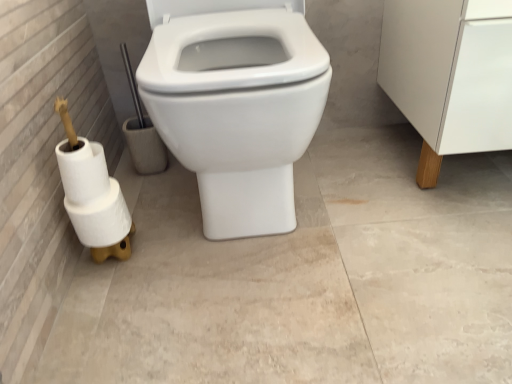
This screenshot has height=384, width=512. What do you see at coordinates (237, 110) in the screenshot?
I see `white glossy toilet at center` at bounding box center [237, 110].

In order to face white matte toilet paper at lower left, the third toilet paper from the top, should I rotate leftwards or rightwards?

Turn left approximately 20.398 degrees to face it.

Locate an element on the screen. This screenshot has width=512, height=384. white matte toilet paper at left, which ranks as the second toilet paper in bottom-to-top order is located at coordinates (92, 194).

Locate an element on the screen. The width and height of the screenshot is (512, 384). white matte toilet paper at lower left, which is counted as the third toilet paper, starting from the bottom is located at coordinates (82, 170).

You are a GUI agent. You are given a task and a screenshot of the screen. Output one action in this format:
    pyautogui.click(x=<x>, y=<y>)
    Task: Click on the white glossy toilet at center
    The image size is (512, 384).
    Given the screenshot: What is the action you would take?
    pyautogui.click(x=237, y=110)

Is white matte toilet paper at lower left, placed as the first toilet paper when sorted from top to bottom, not inside white wood cabinet leg at right?

Result: Yes, white matte toilet paper at lower left, placed as the first toilet paper when sorted from top to bottom, is located beyond the bounds of white wood cabinet leg at right.

Is white matte toilet paper at lower left, placed as the first toilet paper when sorted from top to bottom, beside white wood cabinet leg at right?

No, white matte toilet paper at lower left, placed as the first toilet paper when sorted from top to bottom, is not making contact with white wood cabinet leg at right.

From a real-world perspective, is white matte toilet paper at lower left, placed as the first toilet paper when sorted from top to bottom, positioned under white wood cabinet leg at right based on gravity?

Yes.

From the image's perspective, count 2nd toilet papers upward from the white matte toilet paper at lower left, the third toilet paper from the top, and point to it. Please provide its 2D coordinates.

[(82, 170)]

Considering the positions of objects white matte toilet paper at lower left, which is counted as the third toilet paper, starting from the bottom, and white matte toilet paper at lower left, the third toilet paper from the top, in the image provided, who is more to the left, white matte toilet paper at lower left, which is counted as the third toilet paper, starting from the bottom, or white matte toilet paper at lower left, the third toilet paper from the top,?

white matte toilet paper at lower left, which is counted as the third toilet paper, starting from the bottom, is more to the left.

Can you confirm if white matte toilet paper at lower left, which is counted as the third toilet paper, starting from the bottom, is smaller than white matte toilet paper at lower left, the third toilet paper from the top?

Indeed, white matte toilet paper at lower left, which is counted as the third toilet paper, starting from the bottom, has a smaller size compared to white matte toilet paper at lower left, the third toilet paper from the top.

Does point (127, 220) come farther from viewer compared to point (111, 240)?

That is True.

Is the depth of white matte toilet paper at lower left, the third toilet paper from the top, less than that of white matte toilet paper at left, which is the 2th toilet paper from top to bottom?

No, the depth of white matte toilet paper at lower left, the third toilet paper from the top, is greater than that of white matte toilet paper at left, which is the 2th toilet paper from top to bottom.

From a real-world perspective, between white matte toilet paper at lower left, the third toilet paper from the top, and white matte toilet paper at left, which is the 2th toilet paper from top to bottom, who is vertically higher?

In real-world perspective, white matte toilet paper at left, which is the 2th toilet paper from top to bottom, is above.

Which object is wider, white matte toilet paper at lower left, the 1th toilet paper ordered from the bottom, or white matte toilet paper at left, which ranks as the second toilet paper in bottom-to-top order?

With larger width is white matte toilet paper at lower left, the 1th toilet paper ordered from the bottom.

How many degrees apart are the facing directions of white glossy toilet at center and white matte toilet paper at lower left, the third toilet paper from the top?

white glossy toilet at center and white matte toilet paper at lower left, the third toilet paper from the top, are facing 2.28 degrees away from each other.

Are white glossy toilet at center and white matte toilet paper at lower left, the third toilet paper from the top, beside each other?

No, white glossy toilet at center is not touching white matte toilet paper at lower left, the third toilet paper from the top.

From the white glossy toilet at center, count the 1st toilet paper to the left and point to it. Please provide its 2D coordinates.

[(101, 218)]

Between point (244, 171) and point (124, 213), which one is positioned in front?

The point (244, 171) is closer.

Which object is positioned more to the left, white matte toilet paper at left, which is the 2th toilet paper from top to bottom, or white wood cabinet leg at right?

white matte toilet paper at left, which is the 2th toilet paper from top to bottom, is more to the left.

Considering the positions of point (61, 117) and point (392, 61), is point (61, 117) closer or farther from the camera than point (392, 61)?

Point (61, 117) is positioned closer to the camera compared to point (392, 61).

Is white matte toilet paper at left, which is the 2th toilet paper from top to bottom, thinner than white wood cabinet leg at right?

Indeed, white matte toilet paper at left, which is the 2th toilet paper from top to bottom, has a lesser width compared to white wood cabinet leg at right.

The height and width of the screenshot is (384, 512). In order to click on porcelain above the white matte toilet paper at left, which ranks as the second toilet paper in bottom-to-top order (from a real-world perspective) in this screenshot , I will do `click(449, 75)`.

Looking at their sizes, would you say white wood cabinet leg at right is wider or thinner than white matte toilet paper at lower left, the 1th toilet paper ordered from the bottom?

In the image, white wood cabinet leg at right appears to be wider than white matte toilet paper at lower left, the 1th toilet paper ordered from the bottom.

Is white wood cabinet leg at right facing towards white matte toilet paper at lower left, the third toilet paper from the top?

No.

How much distance is there between white wood cabinet leg at right and white matte toilet paper at lower left, the 1th toilet paper ordered from the bottom?

white wood cabinet leg at right is 29.79 inches away from white matte toilet paper at lower left, the 1th toilet paper ordered from the bottom.

From the picture: From the image's perspective, is white wood cabinet leg at right located above or below white matte toilet paper at lower left, the third toilet paper from the top?

white wood cabinet leg at right is situated higher than white matte toilet paper at lower left, the third toilet paper from the top, in the image.

From the image's perspective, starting from the white wood cabinet leg at right, which toilet paper is the 2nd one below? Please provide its 2D coordinates.

[(92, 194)]

From the image's perspective, is white wood cabinet leg at right on white matte toilet paper at left, which ranks as the second toilet paper in bottom-to-top order?

Correct, white wood cabinet leg at right appears higher than white matte toilet paper at left, which ranks as the second toilet paper in bottom-to-top order, in the image.

Is white matte toilet paper at left, which ranks as the second toilet paper in bottom-to-top order, located within white wood cabinet leg at right?

No, white matte toilet paper at left, which ranks as the second toilet paper in bottom-to-top order, is not inside white wood cabinet leg at right.

Where is `porcelain located above the white matte toilet paper at lower left, which is counted as the third toilet paper, starting from the bottom (from a real-world perspective)`? This screenshot has height=384, width=512. porcelain located above the white matte toilet paper at lower left, which is counted as the third toilet paper, starting from the bottom (from a real-world perspective) is located at coordinates (449, 75).

The width and height of the screenshot is (512, 384). Identify the location of toilet paper behind the white matte toilet paper at lower left, which is counted as the third toilet paper, starting from the bottom. (101, 218).

Estimate the real-world distances between objects in this image. Which object is further from white matte toilet paper at left, which ranks as the second toilet paper in bottom-to-top order, white matte toilet paper at lower left, placed as the first toilet paper when sorted from top to bottom, or white wood cabinet leg at right?

white wood cabinet leg at right is further to white matte toilet paper at left, which ranks as the second toilet paper in bottom-to-top order.

Looking at the image, which one is located closer to white matte toilet paper at lower left, placed as the first toilet paper when sorted from top to bottom, white glossy toilet at center or white matte toilet paper at left, which is the 2th toilet paper from top to bottom?

Among the two, white matte toilet paper at left, which is the 2th toilet paper from top to bottom, is located nearer to white matte toilet paper at lower left, placed as the first toilet paper when sorted from top to bottom.

Estimate the real-world distances between objects in this image. Which object is further from white matte toilet paper at lower left, placed as the first toilet paper when sorted from top to bottom, white glossy toilet at center or white wood cabinet leg at right?

white wood cabinet leg at right lies further to white matte toilet paper at lower left, placed as the first toilet paper when sorted from top to bottom, than the other object.

In the scene shown: When comparing their distances from white matte toilet paper at lower left, which is counted as the third toilet paper, starting from the bottom, does white wood cabinet leg at right or white glossy toilet at center seem closer?

white glossy toilet at center.

Considering their positions, is white matte toilet paper at lower left, which is counted as the third toilet paper, starting from the bottom, positioned closer to white matte toilet paper at left, which is the 2th toilet paper from top to bottom, than white matte toilet paper at lower left, the 1th toilet paper ordered from the bottom?

white matte toilet paper at lower left, the 1th toilet paper ordered from the bottom, is positioned closer to the anchor white matte toilet paper at left, which is the 2th toilet paper from top to bottom.

Which object lies nearer to the anchor point white matte toilet paper at lower left, the 1th toilet paper ordered from the bottom, white matte toilet paper at lower left, placed as the first toilet paper when sorted from top to bottom, or white matte toilet paper at left, which ranks as the second toilet paper in bottom-to-top order?

Based on the image, white matte toilet paper at left, which ranks as the second toilet paper in bottom-to-top order, appears to be nearer to white matte toilet paper at lower left, the 1th toilet paper ordered from the bottom.

Which object lies further to the anchor point white matte toilet paper at lower left, the 1th toilet paper ordered from the bottom, white matte toilet paper at left, which ranks as the second toilet paper in bottom-to-top order, or white wood cabinet leg at right?

The object further to white matte toilet paper at lower left, the 1th toilet paper ordered from the bottom, is white wood cabinet leg at right.

Based on their spatial positions, is white matte toilet paper at lower left, placed as the first toilet paper when sorted from top to bottom, or white glossy toilet at center further from white wood cabinet leg at right?

white matte toilet paper at lower left, placed as the first toilet paper when sorted from top to bottom, is further to white wood cabinet leg at right.

Image resolution: width=512 pixels, height=384 pixels. Find the location of `toilet situated between white matte toilet paper at lower left, which is counted as the third toilet paper, starting from the bottom, and white wood cabinet leg at right from left to right`. toilet situated between white matte toilet paper at lower left, which is counted as the third toilet paper, starting from the bottom, and white wood cabinet leg at right from left to right is located at coordinates (237, 110).

The width and height of the screenshot is (512, 384). I want to click on toilet paper between white matte toilet paper at lower left, which is counted as the third toilet paper, starting from the bottom, and white matte toilet paper at lower left, the third toilet paper from the top, in the vertical direction, so click(92, 194).

This screenshot has height=384, width=512. I want to click on toilet between white matte toilet paper at lower left, the 1th toilet paper ordered from the bottom, and white wood cabinet leg at right from left to right, so click(x=237, y=110).

The width and height of the screenshot is (512, 384). Identify the location of toilet paper situated between white matte toilet paper at lower left, placed as the first toilet paper when sorted from top to bottom, and white wood cabinet leg at right from left to right. (101, 218).